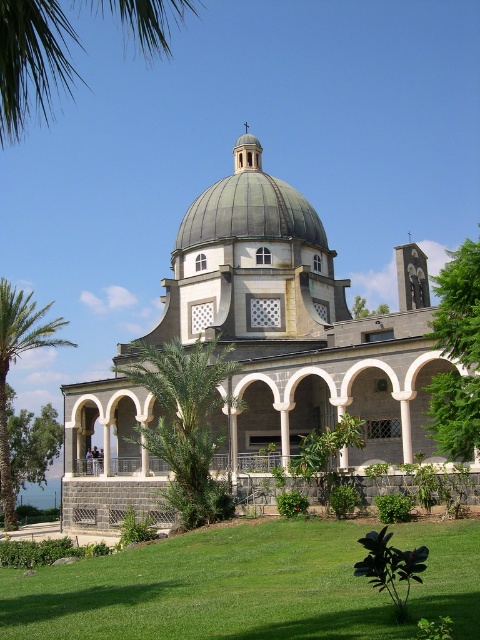
Question: Which object is the farthest from the green leafy tree at right?

Choices:
 (A) green grass at lower center
 (B) gray stone church at center

Answer: (B)

Question: Considering the relative positions of green grass at lower center and green metallic dome at center in the image provided, where is green grass at lower center located with respect to green metallic dome at center?

Choices:
 (A) below
 (B) above

Answer: (A)

Question: Can you confirm if green leafy palm tree at center is wider than green leafy tree at lower left?

Choices:
 (A) yes
 (B) no

Answer: (B)

Question: Is green leafy palm tree at upper left below green leafy tree at right?

Choices:
 (A) yes
 (B) no

Answer: (B)

Question: Which point is closer to the camera taking this photo?

Choices:
 (A) (170, 416)
 (B) (467, 346)
 (C) (214, 198)

Answer: (B)

Question: Among these objects, which one is nearest to the camera?

Choices:
 (A) green leafy tree at lower left
 (B) gray stone church at center

Answer: (B)